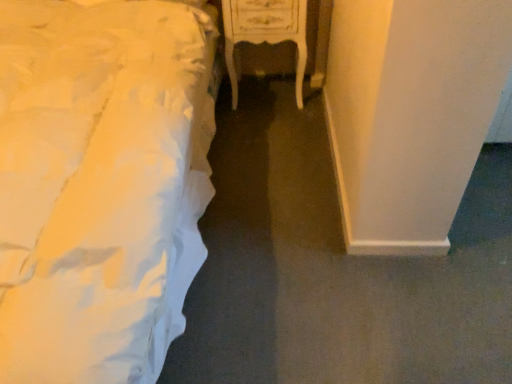
You are a GUI agent. You are given a task and a screenshot of the screen. Output one action in this format:
    pyautogui.click(x=<x>, y=<y>)
    Task: Click on the white glossy nightstand at center
    Image resolution: width=512 pixels, height=384 pixels.
    Given the screenshot: What is the action you would take?
    pyautogui.click(x=265, y=33)

Describe the element at coordinates (265, 33) in the screenshot. I see `white glossy nightstand at center` at that location.

This screenshot has width=512, height=384. What do you see at coordinates (100, 183) in the screenshot?
I see `white fabric bed at left` at bounding box center [100, 183].

Identify the location of white fabric bed at left. (100, 183).

You are a GUI agent. You are given a task and a screenshot of the screen. Output one action in this format:
    pyautogui.click(x=<x>, y=<y>)
    Task: Click on the white glossy nightstand at center
    
    Given the screenshot: What is the action you would take?
    pyautogui.click(x=265, y=33)

Considering the positions of objects white fabric bed at left and white glossy nightstand at center in the image provided, who is more to the right, white fabric bed at left or white glossy nightstand at center?

Positioned to the right is white glossy nightstand at center.

Which object is more forward, white fabric bed at left or white glossy nightstand at center?

white fabric bed at left.

Does point (62, 245) come behind point (302, 83)?

No, it is not.

From the image's perspective, does white fabric bed at left appear lower than white glossy nightstand at center?

Yes, from the image's perspective, white fabric bed at left is beneath white glossy nightstand at center.

From a real-world perspective, which object rests below the other?

white glossy nightstand at center is physically lower.

Considering the relative sizes of white fabric bed at left and white glossy nightstand at center in the image provided, is white fabric bed at left wider than white glossy nightstand at center?

Correct, the width of white fabric bed at left exceeds that of white glossy nightstand at center.

Considering the relative sizes of white fabric bed at left and white glossy nightstand at center in the image provided, is white fabric bed at left shorter than white glossy nightstand at center?

In fact, white fabric bed at left may be taller than white glossy nightstand at center.

Who is smaller, white fabric bed at left or white glossy nightstand at center?

With smaller size is white glossy nightstand at center.

Is white fabric bed at left inside the boundaries of white glossy nightstand at center, or outside?

Answer: white fabric bed at left is spatially situated outside white glossy nightstand at center.

Can you see white fabric bed at left touching white glossy nightstand at center?

white fabric bed at left is not next to white glossy nightstand at center, and they're not touching.

Is white fabric bed at left oriented away from white glossy nightstand at center?

No, white fabric bed at left's orientation is not away from white glossy nightstand at center.

You are a GUI agent. You are given a task and a screenshot of the screen. Output one action in this format:
    pyautogui.click(x=<x>, y=<y>)
    Task: Click on the bed above the white glossy nightstand at center (from a real-world perspective)
    
    Given the screenshot: What is the action you would take?
    pyautogui.click(x=100, y=183)

Considering the positions of objects white glossy nightstand at center and white fabric bed at left in the image provided, who is more to the right, white glossy nightstand at center or white fabric bed at left?

white glossy nightstand at center.

Is the depth of white glossy nightstand at center less than that of white fabric bed at left?

No, the depth of white glossy nightstand at center is greater than that of white fabric bed at left.

Which is less distant, (229, 8) or (86, 36)?

The point (86, 36) is more forward.

From the image's perspective, which one is positioned higher, white glossy nightstand at center or white fabric bed at left?

From the image's view, white glossy nightstand at center is above.

From a real-world perspective, is white glossy nightstand at center below white fabric bed at left?

Yes, from a real-world perspective, white glossy nightstand at center is below white fabric bed at left.

Between white glossy nightstand at center and white fabric bed at left, which one has smaller width?

With smaller width is white glossy nightstand at center.

Does white glossy nightstand at center have a lesser height compared to white fabric bed at left?

Yes, white glossy nightstand at center is shorter than white fabric bed at left.

Is white glossy nightstand at center smaller than white fabric bed at left?

Indeed, white glossy nightstand at center has a smaller size compared to white fabric bed at left.

From the picture: Is white glossy nightstand at center outside of white fabric bed at left?

Yes.

Is white glossy nightstand at center not close to white fabric bed at left?

No, white glossy nightstand at center is not far from white fabric bed at left.

Does white glossy nightstand at center turn towards white fabric bed at left?

No, white glossy nightstand at center is not turned towards white fabric bed at left.

What's the angular difference between white glossy nightstand at center and white fabric bed at left's facing directions?

The angular difference between white glossy nightstand at center and white fabric bed at left is 0.883 degrees.

This screenshot has width=512, height=384. In order to click on bed lying below the white glossy nightstand at center (from the image's perspective) in this screenshot , I will do `click(100, 183)`.

Identify the location of bed in front of the white glossy nightstand at center. (100, 183).

Find the location of a particular element. The width and height of the screenshot is (512, 384). furniture on the right of white fabric bed at left is located at coordinates (265, 33).